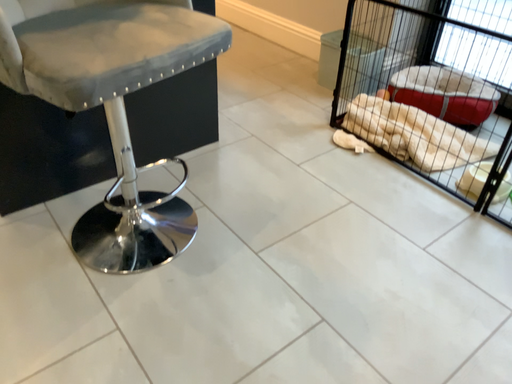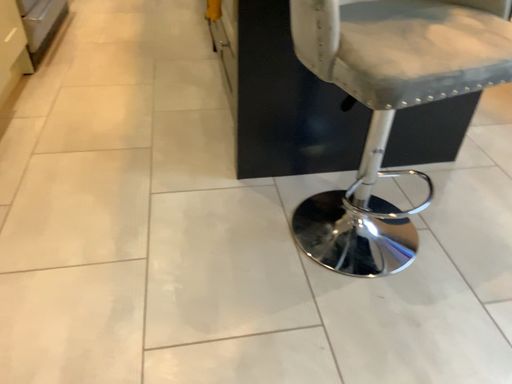
Question: Which way did the camera rotate in the video?

Choices:
 (A) rotated left
 (B) rotated right

Answer: (A)